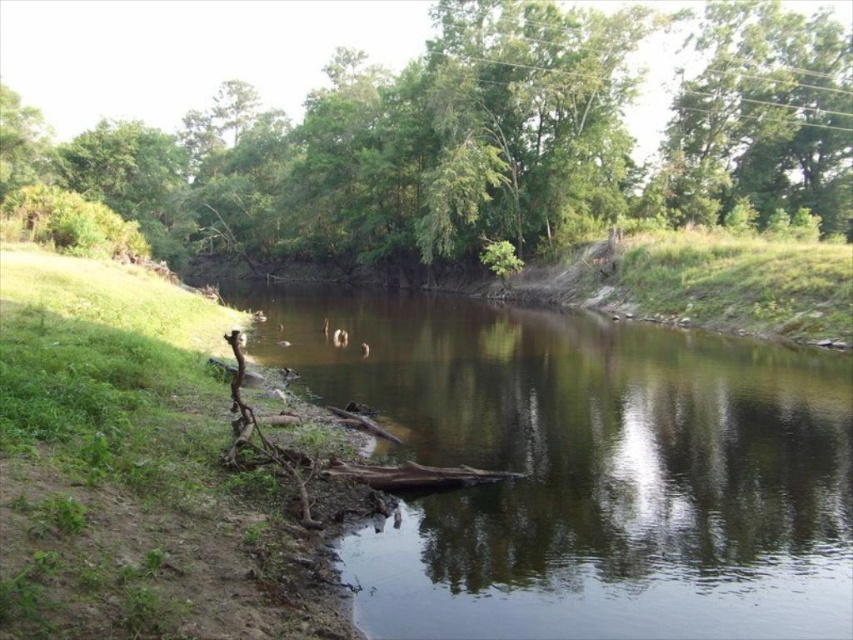
Question: Which object appears closest to the camera in this image?

Choices:
 (A) brown dirt river at center
 (B) green leafy tree at center

Answer: (A)

Question: Does brown dirt river at center have a smaller size compared to green leafy tree at center?

Choices:
 (A) no
 (B) yes

Answer: (B)

Question: Does brown dirt river at center have a larger size compared to green leafy tree at center?

Choices:
 (A) yes
 (B) no

Answer: (B)

Question: Considering the relative positions of brown dirt river at center and green leafy tree at center in the image provided, where is brown dirt river at center located with respect to green leafy tree at center?

Choices:
 (A) left
 (B) right

Answer: (B)